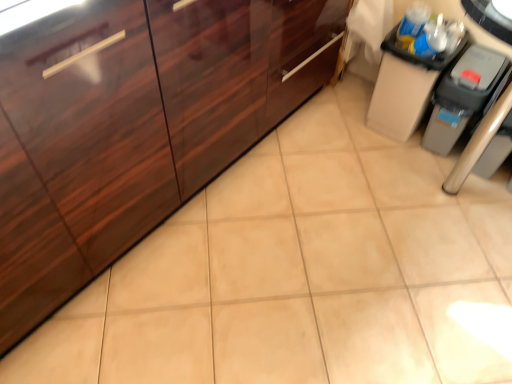
Question: Is gray plastic trash can at right positioned with its back to glossy wood cabinetry at left, marked as the 1th cabinetry in a left-to-right arrangement?

Choices:
 (A) no
 (B) yes

Answer: (A)

Question: From the image's perspective, is gray plastic trash can at right on glossy wood cabinetry at left, marked as the 1th cabinetry in a left-to-right arrangement?

Choices:
 (A) no
 (B) yes

Answer: (A)

Question: Does gray plastic trash can at right appear on the left side of glossy wood cabinetry at left, the second cabinetry in the right-to-left sequence?

Choices:
 (A) no
 (B) yes

Answer: (A)

Question: Is the depth of gray plastic trash can at right less than that of glossy wood cabinetry at left, the second cabinetry in the right-to-left sequence?

Choices:
 (A) no
 (B) yes

Answer: (A)

Question: Considering the relative sizes of gray plastic trash can at right and glossy wood cabinetry at left, the second cabinetry in the right-to-left sequence, in the image provided, is gray plastic trash can at right wider than glossy wood cabinetry at left, the second cabinetry in the right-to-left sequence,?

Choices:
 (A) no
 (B) yes

Answer: (A)

Question: From the image's perspective, is gray plastic trash can at right under glossy wood cabinetry at left, the second cabinetry in the right-to-left sequence?

Choices:
 (A) yes
 (B) no

Answer: (A)

Question: Is matte black trash can at upper right, acting as the 2th cabinetry starting from the left, bigger than gray plastic trash can at right?

Choices:
 (A) yes
 (B) no

Answer: (A)

Question: Considering the relative sizes of matte black trash can at upper right, acting as the 2th cabinetry starting from the left, and gray plastic trash can at right in the image provided, is matte black trash can at upper right, acting as the 2th cabinetry starting from the left, taller than gray plastic trash can at right?

Choices:
 (A) no
 (B) yes

Answer: (B)

Question: From a real-world perspective, does matte black trash can at upper right, acting as the 2th cabinetry starting from the left, sit lower than gray plastic trash can at right?

Choices:
 (A) yes
 (B) no

Answer: (B)

Question: From the image's perspective, is matte black trash can at upper right, positioned as the 1th cabinetry in right-to-left order, on gray plastic trash can at right?

Choices:
 (A) no
 (B) yes

Answer: (B)

Question: Is matte black trash can at upper right, acting as the 2th cabinetry starting from the left, oriented away from gray plastic trash can at right?

Choices:
 (A) yes
 (B) no

Answer: (B)

Question: Is matte black trash can at upper right, positioned as the 1th cabinetry in right-to-left order, wider than gray plastic trash can at right?

Choices:
 (A) yes
 (B) no

Answer: (A)

Question: Does glossy wood cabinetry at left, the second cabinetry in the right-to-left sequence, turn towards matte black trash can at upper right, positioned as the 1th cabinetry in right-to-left order?

Choices:
 (A) yes
 (B) no

Answer: (A)